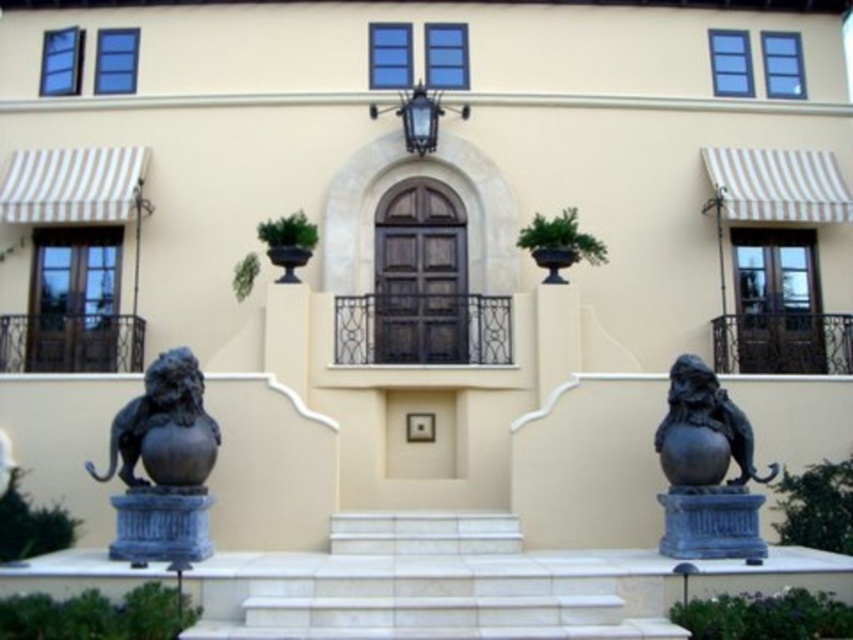
You are a delivery person carrying a large package that measures 4 meters in length. You need to navigate between the white marble stairs at center and the black polished stone lion at right to reach the entrance. Will your package fit through the space between them?

The white marble stairs at center and the black polished stone lion at right are 4.17 meters apart from each other. Since your package is 4 meters in length, it will fit through the space between them as there is enough clearance.

You are standing in front of the building and want to see the top of the bronze lion at left. Can you see it without climbing the white marble stairs at center?

The white marble stairs at center is not as tall as bronze lion at left, so yes, you can see the top of the bronze lion at left without climbing the stairs.

You are a visitor approaching the building and want to know which lion statue is taller. Based on the scene, can you determine which one is taller between the bronze lion at left and the black polished stone lion at right?

The bronze lion at left is taller than the black polished stone lion at right.